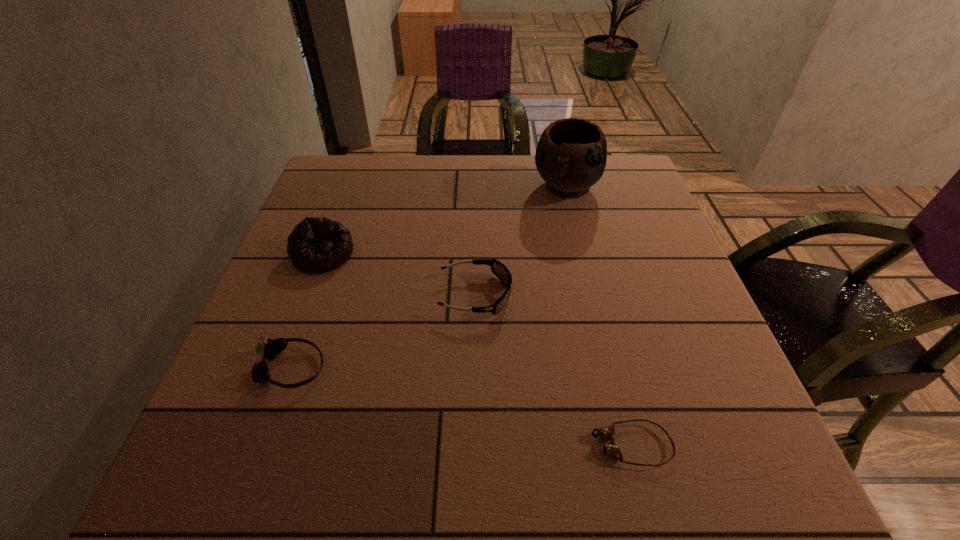
You are a GUI agent. You are given a task and a screenshot of the screen. Output one action in this format:
    pyautogui.click(x=<x>, y=<y>)
    Task: Click on the pottery
    Image resolution: width=960 pixels, height=540 pixels.
    Given the screenshot: What is the action you would take?
    pyautogui.click(x=571, y=155)

In order to click on the tallest object in this screenshot , I will do `click(571, 155)`.

Locate an element on the screen. The width and height of the screenshot is (960, 540). beanbag is located at coordinates (317, 244).

You are a GUI agent. You are given a task and a screenshot of the screen. Output one action in this format:
    pyautogui.click(x=<x>, y=<y>)
    Task: Click on the second goggles from right to left
    This screenshot has width=960, height=540.
    Given the screenshot: What is the action you would take?
    pyautogui.click(x=499, y=269)

Where is `the third object from left to right`? the third object from left to right is located at coordinates 499,269.

In order to click on the second nearest goggles in this screenshot , I will do `click(270, 349)`.

Identify the location of the leftmost goggles. (270, 349).

Locate an element on the screen. The height and width of the screenshot is (540, 960). the rightmost goggles is located at coordinates (612, 449).

At what (x,y) coordinates should I click in order to perform the action: click on the nearest object. Please return your answer as a coordinate pair (x, y). The height and width of the screenshot is (540, 960). Looking at the image, I should click on (612, 449).

Find the location of a particular element. vacant region located 0.240m on the front of the farthest object is located at coordinates 588,274.